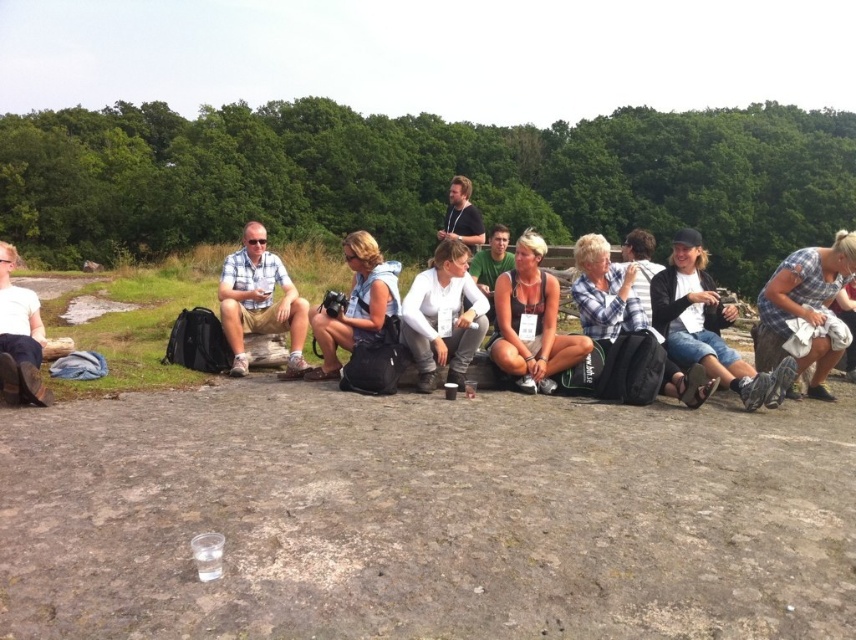
Does plaid fabric dress at right have a greater height compared to matte white tank top at center?

Indeed, plaid fabric dress at right has a greater height compared to matte white tank top at center.

Does plaid fabric dress at right appear on the left side of matte white tank top at center?

No, plaid fabric dress at right is not to the left of matte white tank top at center.

Which is in front, point (825, 321) or point (526, 253)?

Point (825, 321) is more forward.

You are a GUI agent. You are given a task and a screenshot of the screen. Output one action in this format:
    pyautogui.click(x=<x>, y=<y>)
    Task: Click on the plaid fabric dress at right
    The height and width of the screenshot is (640, 856).
    Given the screenshot: What is the action you would take?
    pyautogui.click(x=807, y=308)

Is the position of matte black boots at lower left more distant than that of dark blue shirt at center?

That is False.

Between matte black boots at lower left and dark blue shirt at center, which one appears on the left side from the viewer's perspective?

matte black boots at lower left is more to the left.

Measure the distance between point (x=24, y=362) and camera.

A distance of 13.31 feet exists between point (x=24, y=362) and camera.

This screenshot has height=640, width=856. I want to click on matte black boots at lower left, so click(19, 337).

Image resolution: width=856 pixels, height=640 pixels. What do you see at coordinates (355, 305) in the screenshot? I see `matte black camera at center` at bounding box center [355, 305].

Image resolution: width=856 pixels, height=640 pixels. What are the coordinates of `matte black camera at center` in the screenshot? It's located at (355, 305).

Is point (360, 273) more distant than point (444, 227)?

No, it is not.

Identify the location of matte black camera at center. The height and width of the screenshot is (640, 856). (355, 305).